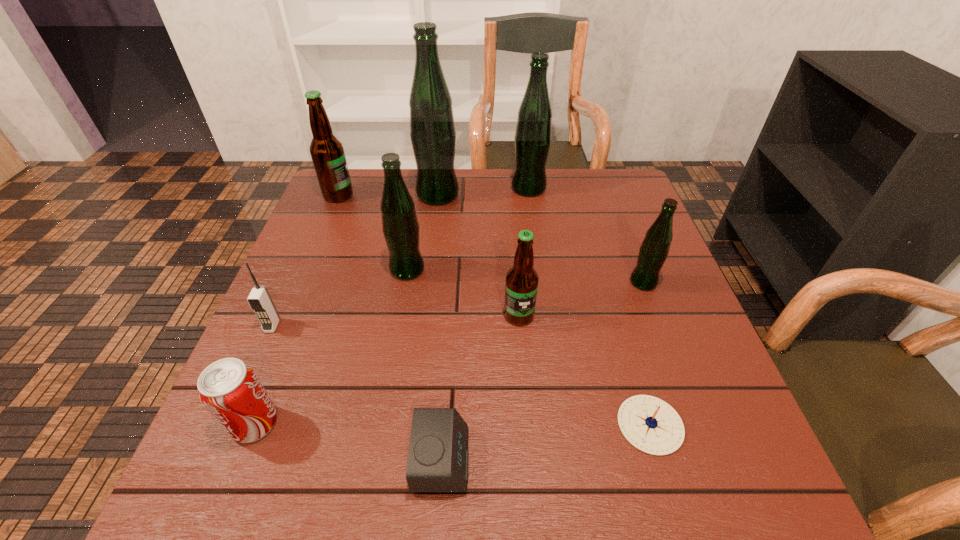
Image resolution: width=960 pixels, height=540 pixels. Identify the location of beer bottle at the left edge. (327, 152).

Locate an element on the screen. Image resolution: width=960 pixels, height=540 pixels. cellular telephone that is at the left edge is located at coordinates (259, 299).

The width and height of the screenshot is (960, 540). I want to click on soda can that is at the left edge, so click(229, 388).

Where is `beer bottle present at the right edge`? beer bottle present at the right edge is located at coordinates (653, 252).

Find the location of a particular element. This screenshot has width=960, height=540. compass that is at the right edge is located at coordinates (650, 424).

The height and width of the screenshot is (540, 960). What are the coordinates of `object that is at the far left corner` in the screenshot? It's located at (327, 152).

This screenshot has height=540, width=960. Find the location of `object that is at the near right corner`. object that is at the near right corner is located at coordinates (650, 424).

You are a GUI agent. You are given a task and a screenshot of the screen. Output one action in this format:
    pyautogui.click(x=<x>, y=<y>)
    Task: Click on the vacant region at the near edge
    
    Given the screenshot: What is the action you would take?
    pyautogui.click(x=477, y=478)

I want to click on free space at the left edge of the desktop, so click(x=317, y=386).

The height and width of the screenshot is (540, 960). In the image, there is a desktop. In order to click on free region at the right edge in this screenshot , I will do `click(625, 244)`.